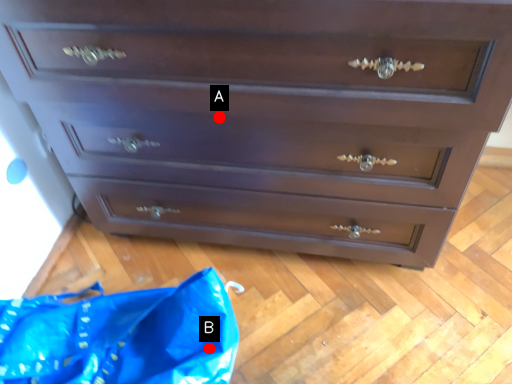
Question: Two points are circled on the image, labeled by A and B beside each circle. Which point is closer to the camera?

Choices:
 (A) A is closer
 (B) B is closer

Answer: (A)